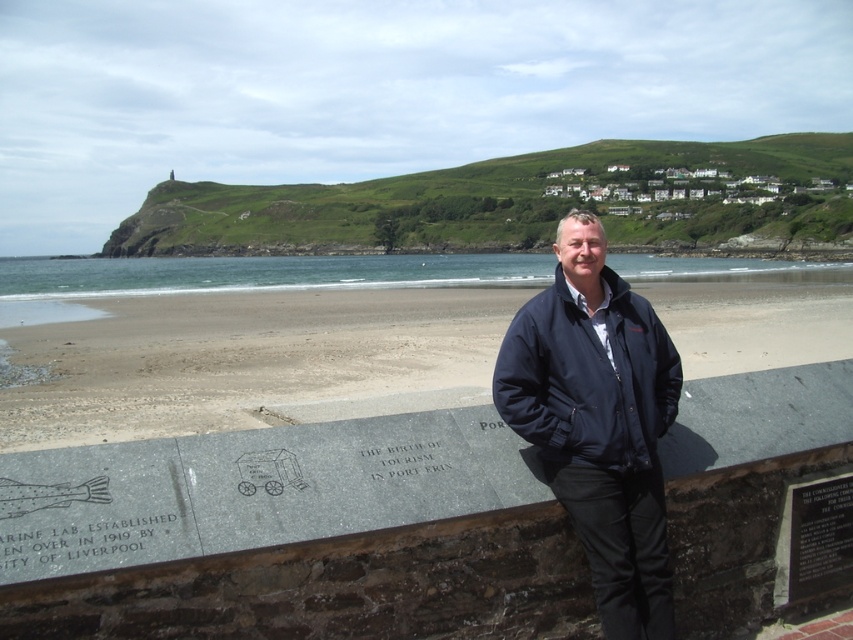
You are a photographer trying to capture both the navy blue jacket at center and the black metal plaque at lower right in a single frame. Based on their sizes, which object should you focus on first to ensure both are in clear view?

The navy blue jacket at center is much taller than the black metal plaque at lower right, so you should focus on the navy blue jacket at center first to ensure both are in clear view.